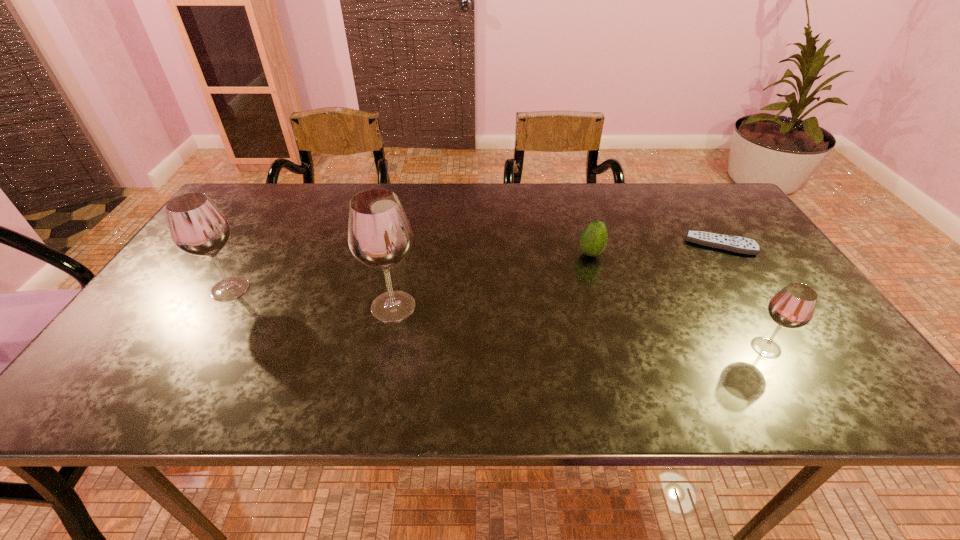
At what (x,y) coordinates should I click in order to perform the action: click on wineglass that stands as the closest to the fourth tallest object. Please return your answer as a coordinate pair (x, y). Image resolution: width=960 pixels, height=540 pixels. Looking at the image, I should click on (793, 306).

At what (x,y) coordinates should I click in order to perform the action: click on free location that satisfies the following two spatial constraints: 1. on the back side of the second wineglass from right to left; 2. on the left side of the shortest object. Please return your answer as a coordinate pair (x, y). This screenshot has height=540, width=960. Looking at the image, I should click on (405, 245).